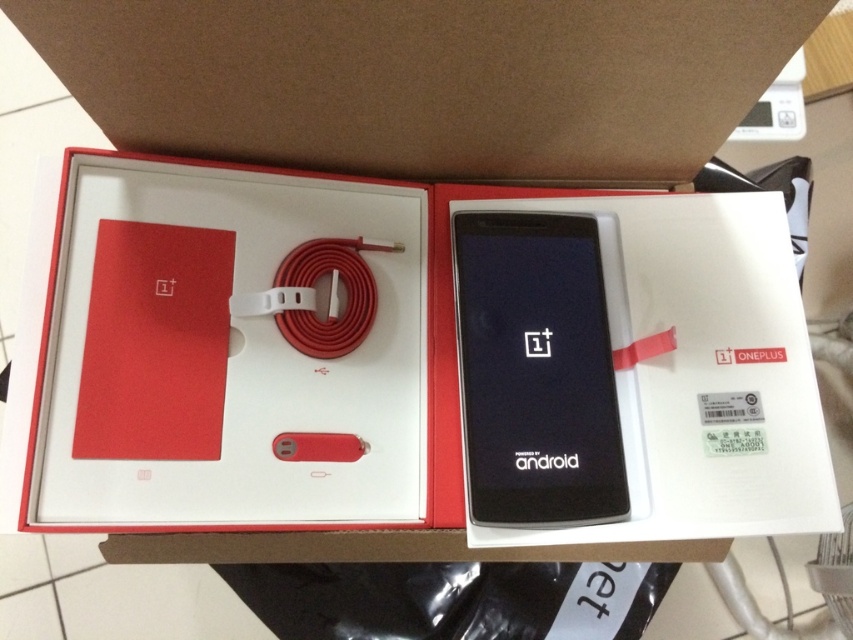
Question: Does white matte cardboard box at center have a lesser width compared to black glossy phone at center?

Choices:
 (A) no
 (B) yes

Answer: (A)

Question: Which point is closer to the camera?

Choices:
 (A) (570, 520)
 (B) (193, 310)

Answer: (A)

Question: Is the position of white matte cardboard box at center less distant than that of black glossy phone at center?

Choices:
 (A) no
 (B) yes

Answer: (B)

Question: Does white matte cardboard box at center have a greater width compared to black glossy phone at center?

Choices:
 (A) no
 (B) yes

Answer: (B)